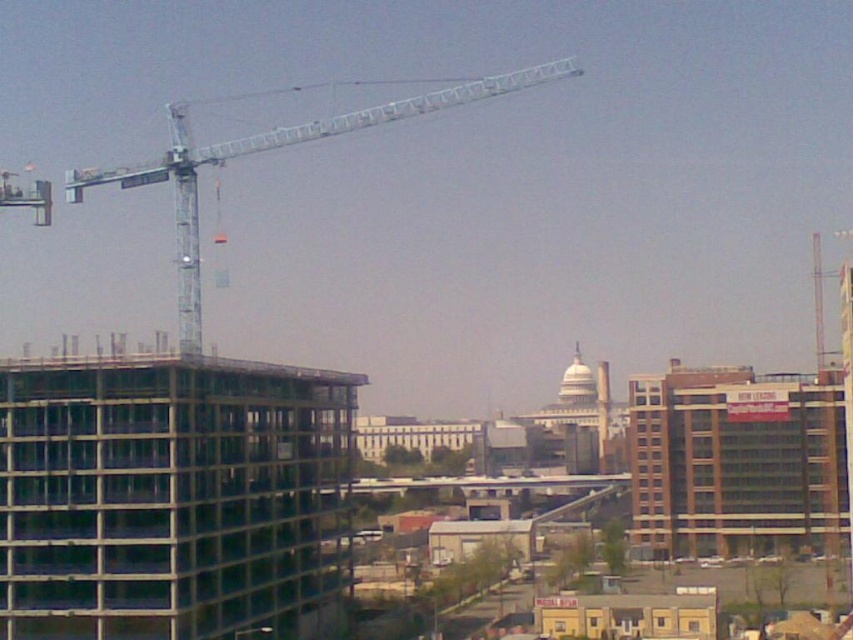
Question: Can you confirm if metallic glass building at left is bigger than metallic silver crane at upper left?

Choices:
 (A) yes
 (B) no

Answer: (B)

Question: Can you confirm if metallic glass building at left is bigger than metallic silver crane at upper left?

Choices:
 (A) yes
 (B) no

Answer: (B)

Question: Which point is closer to the camera taking this photo?

Choices:
 (A) (103, 596)
 (B) (267, 147)

Answer: (A)

Question: Does metallic glass building at left appear over metallic silver crane at upper left?

Choices:
 (A) no
 (B) yes

Answer: (A)